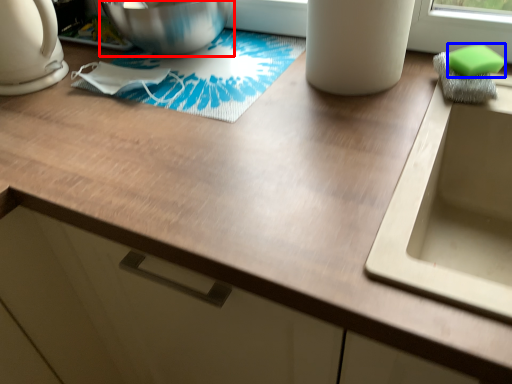
Question: Which point is further to the camera, mixing bowl (highlighted by a red box) or soap (highlighted by a blue box)?

Choices:
 (A) mixing bowl
 (B) soap

Answer: (A)